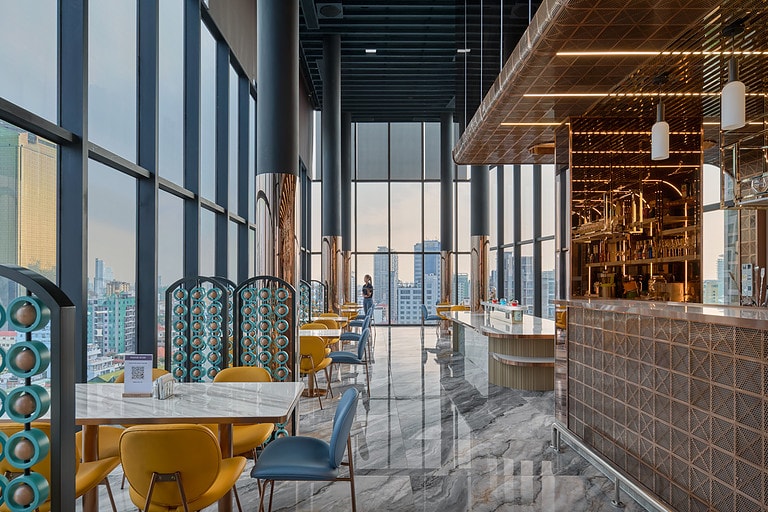
Locate an element on the screen. The image size is (768, 512). tables is located at coordinates (230, 405), (330, 333), (339, 319), (353, 308), (358, 304), (438, 304).